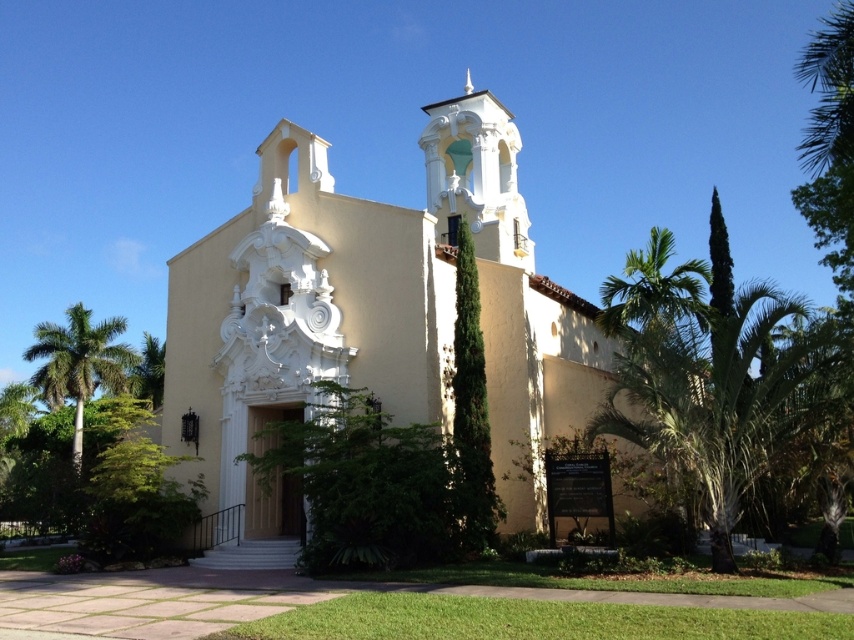
You are standing in front of the Spanish church and notice two points marked on its facade. The first point is at coordinate point(165, 365) and the second is at point(110, 317). Which of these points is closer to you?

Point(165, 365) is closer to the viewer than point(110, 317).

You are a drone operator planning to fly a drone from the beige stucco church at center to the white ornate bell tower at upper center. The drone has a maximum flight range of 7 meters. Will it be able to reach the tower without needing to recharge?

The distance between the beige stucco church at center and the white ornate bell tower at upper center is 7.29 meters, which exceeds the drone operator drone has a maximum flight range of 7 meters. Therefore, the drone will not be able to reach the tower without recharging.